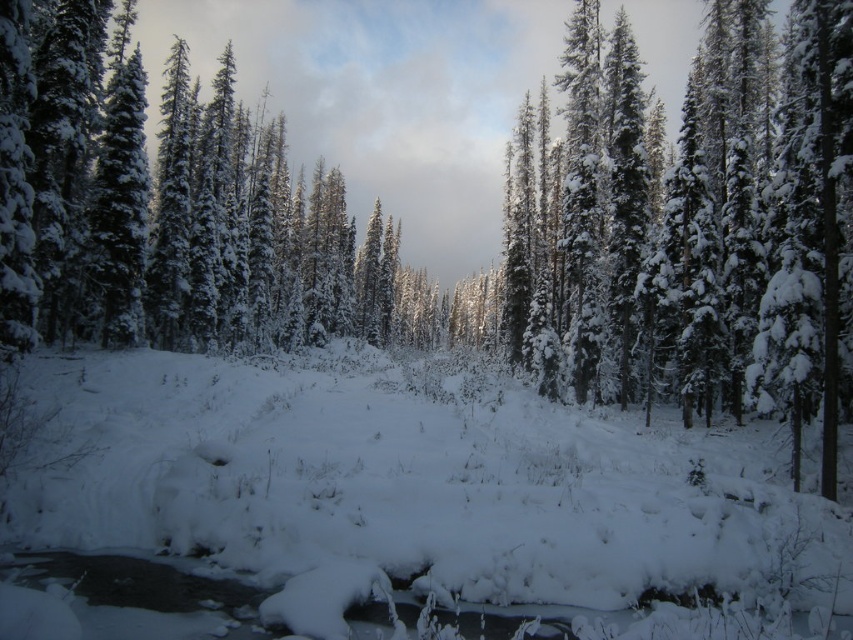
Can you confirm if white fluffy snow at center is positioned above green matte tree at center?

Incorrect, white fluffy snow at center is not positioned above green matte tree at center.

Measure the distance between white fluffy snow at center and camera.

white fluffy snow at center and camera are 9.13 meters apart.

This screenshot has width=853, height=640. I want to click on white fluffy snow at center, so click(405, 484).